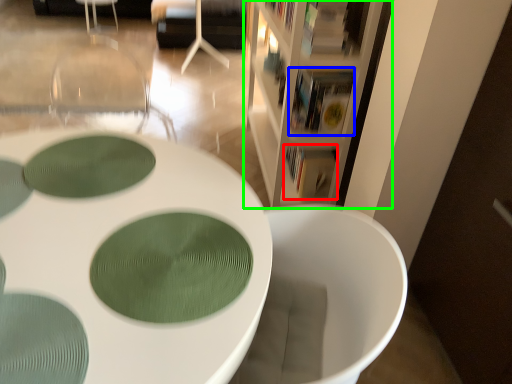
Question: Based on their relative distances, which object is nearer to book (highlighted by a red box)? Choose from book (highlighted by a blue box) and bookcase (highlighted by a green box).

Choices:
 (A) book
 (B) bookcase

Answer: (A)